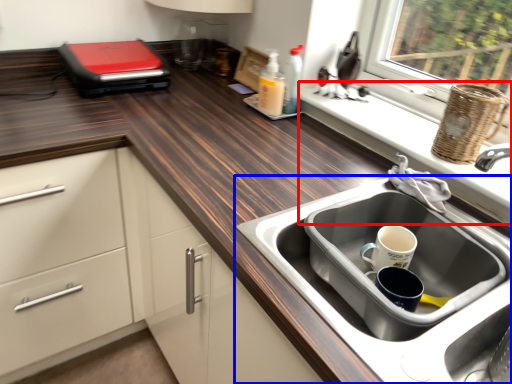
Question: Which of the following is the closest to the observer, window sill (highlighted by a red box) or sink (highlighted by a blue box)?

Choices:
 (A) window sill
 (B) sink

Answer: (B)